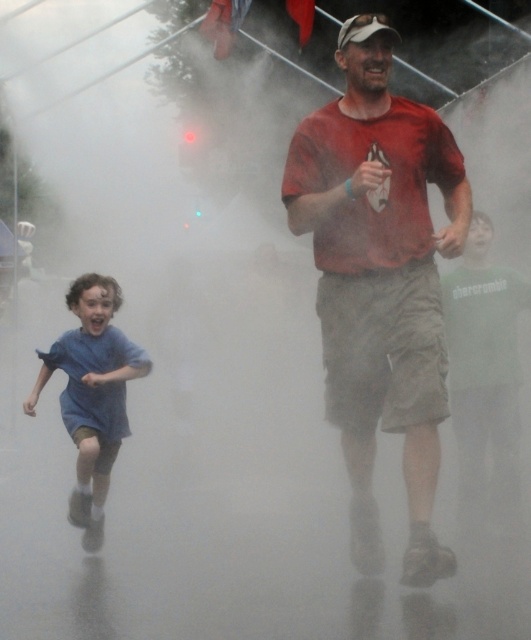
Question: Can you confirm if matte red shirt at center is positioned to the left of blue cotton shirt at left?

Choices:
 (A) yes
 (B) no

Answer: (B)

Question: Can you confirm if matte red shirt at center is positioned to the left of blue cotton shirt at left?

Choices:
 (A) no
 (B) yes

Answer: (A)

Question: Can you confirm if matte red shirt at center is wider than blue cotton shirt at left?

Choices:
 (A) no
 (B) yes

Answer: (B)

Question: Which of the following is the closest to the observer?

Choices:
 (A) (442, 365)
 (B) (107, 321)

Answer: (A)